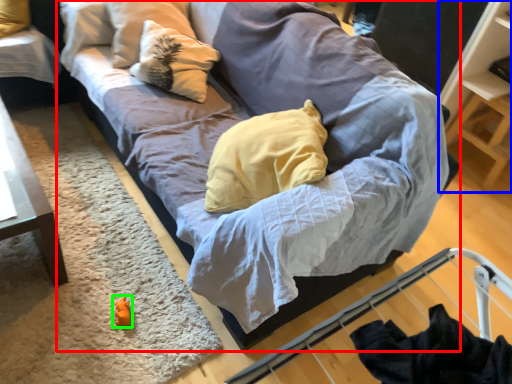
Question: Estimate the real-world distances between objects in this image. Which object is farther from studio couch (highlighted by a red box), shelf (highlighted by a blue box) or toy (highlighted by a green box)?

Choices:
 (A) shelf
 (B) toy

Answer: (A)